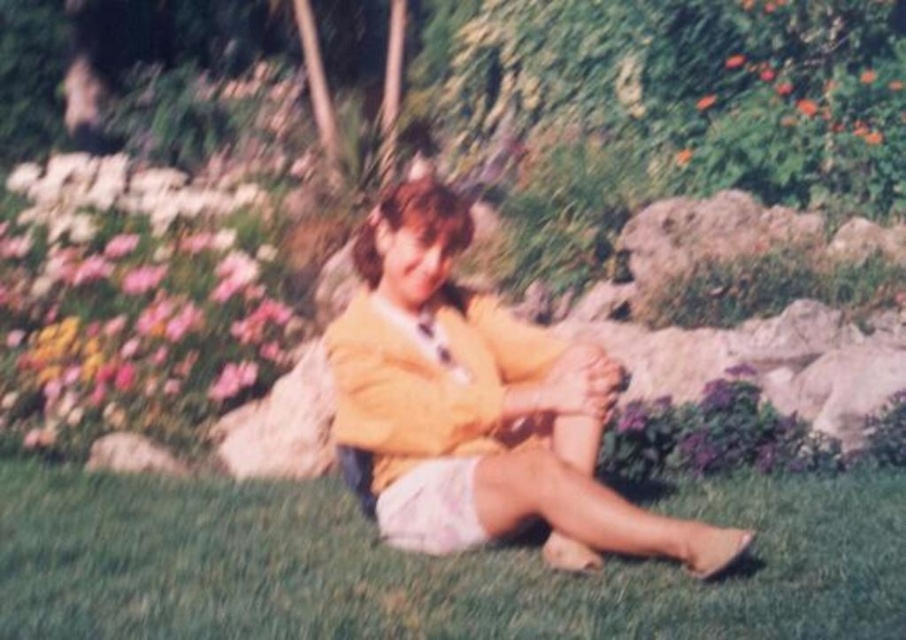
You are a photographer trying to capture a photo of the yellow matte jacket at center and the pink matte flower at left. Based on their heights, which object should you adjust your camera angle to focus on first?

The yellow matte jacket at center is not as tall as the pink matte flower at left, so you should focus on the pink matte flower at left first since it is taller.

You are trying to decide which item to pack for a hike. You see the yellow matte jacket at center and the pink satin skirt at lower center. Which item is larger in size?

The yellow matte jacket at center is bigger than the pink satin skirt at lower center, so you should pack the yellow matte jacket at center since it is larger.

You are a photographer wanting to capture the pink satin skirt at lower center and the pink matte flower at left in your shot. Which object should you adjust your camera to focus on first if you want to include both in the frame without moving the camera?

You should focus on the pink satin skirt at lower center first because the pink matte flower at left is to the left of it, so adjusting the camera to center on the skirt ensures both are included in the frame.